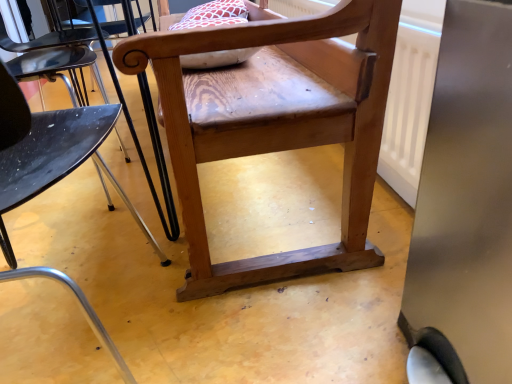
Locate an element on the screen. The width and height of the screenshot is (512, 384). unoccupied region to the right of wooden chair at center, which appears as the 2th chair when viewed from the back is located at coordinates pyautogui.click(x=257, y=305).